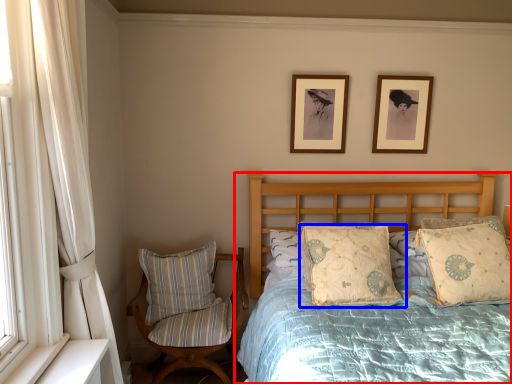
Question: Which object appears farthest to the camera in this image, bed (highlighted by a red box) or pillow (highlighted by a blue box)?

Choices:
 (A) bed
 (B) pillow

Answer: (B)